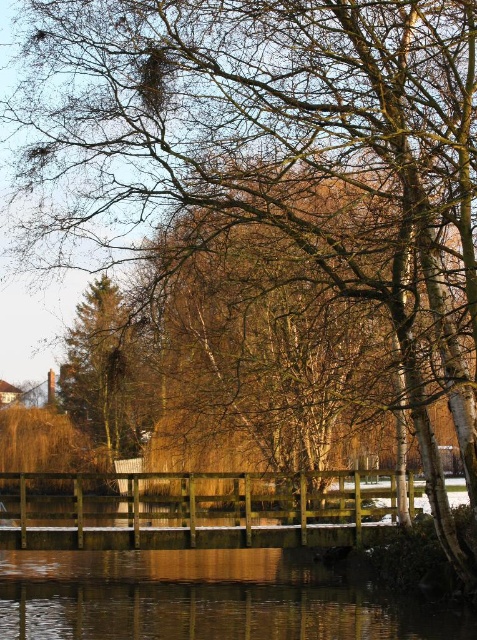
Question: Can you confirm if transparent water at lower center is thinner than green matte tree at left?

Choices:
 (A) yes
 (B) no

Answer: (A)

Question: Is transparent water at lower center positioned before green matte tree at left?

Choices:
 (A) yes
 (B) no

Answer: (A)

Question: Is transparent water at lower center smaller than green matte tree at left?

Choices:
 (A) yes
 (B) no

Answer: (A)

Question: Which point is closer to the camera taking this photo?

Choices:
 (A) (114, 444)
 (B) (207, 627)

Answer: (B)